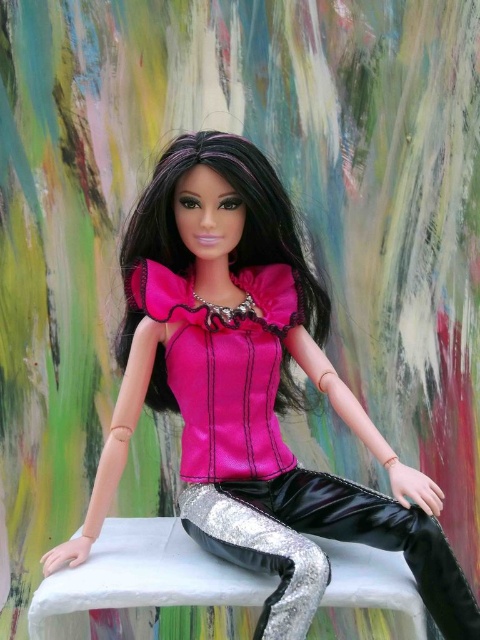
Question: Which of the following is the farthest from the observer?

Choices:
 (A) silver metallic pants at center
 (B) satin pink blouse at center

Answer: (B)

Question: Is satin pink blouse at center to the left of silver metallic pants at center from the viewer's perspective?

Choices:
 (A) no
 (B) yes

Answer: (B)

Question: Can you confirm if satin pink blouse at center is positioned above silver metallic pants at center?

Choices:
 (A) no
 (B) yes

Answer: (B)

Question: Which of the following is the closest to the observer?

Choices:
 (A) silver metallic pants at center
 (B) satin pink blouse at center

Answer: (A)

Question: Is satin pink blouse at center thinner than silver metallic pants at center?

Choices:
 (A) yes
 (B) no

Answer: (B)